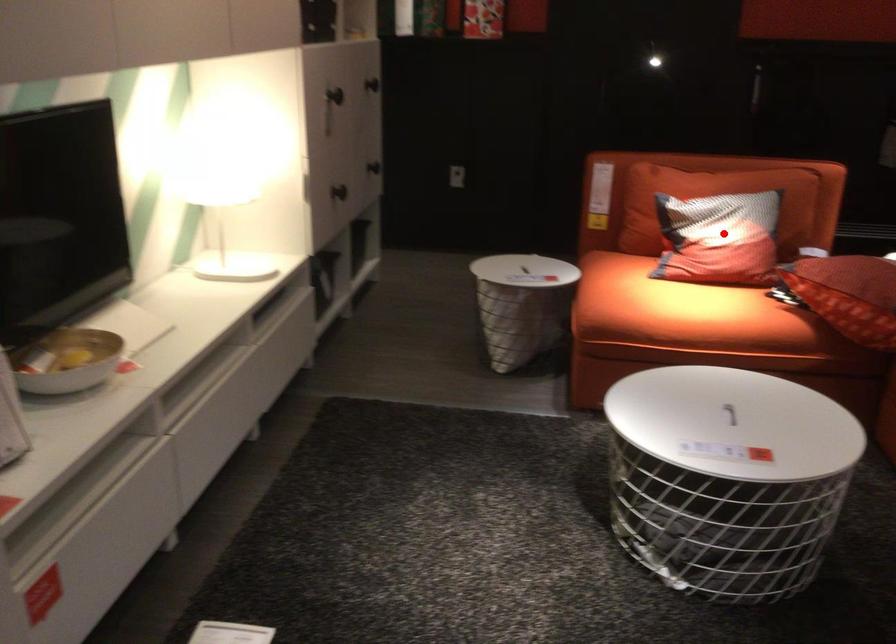
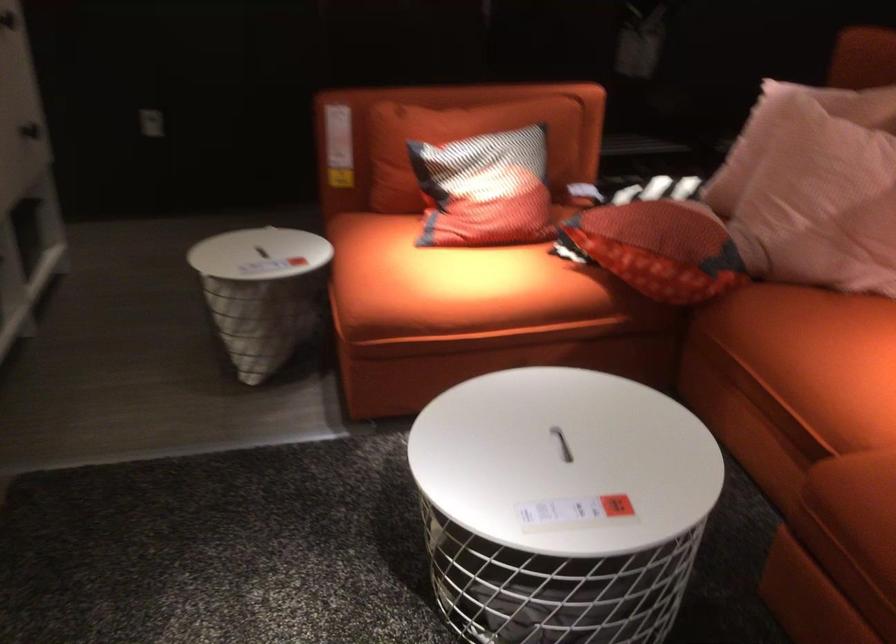
Locate, in the second image, the point that corresponds to the highlighted location in the first image.

(485, 190)